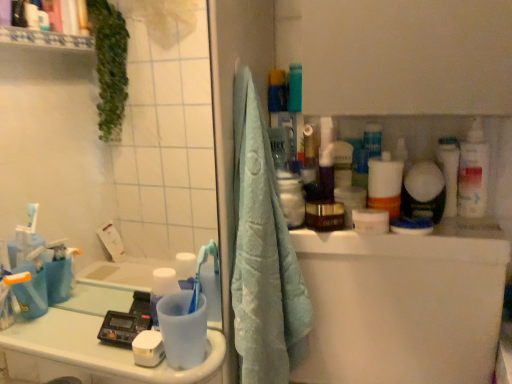
Question: Is white glossy toothbrush at upper right bigger or smaller than white glossy counter top at lower left?

Choices:
 (A) big
 (B) small

Answer: (B)

Question: Does point coord(438,162) appear closer or farther from the camera than point coord(208,334)?

Choices:
 (A) closer
 (B) farther

Answer: (B)

Question: Which is farther from the transparent plastic mirror at upper left?

Choices:
 (A) blue plastic toothbrush at lower left
 (B) light blue towel at center
 (C) white glossy counter top at lower left
 (D) white plastic bottle at right
 (E) white glossy toothbrush at upper right

Answer: (D)

Question: Estimate the real-world distances between objects in this image. Which object is closer to the blue plastic toothbrush at lower left?

Choices:
 (A) white glossy toothbrush at upper right
 (B) light blue towel at center
 (C) transparent plastic mirror at upper left
 (D) white glossy counter top at lower left
 (E) white plastic bottle at right

Answer: (B)